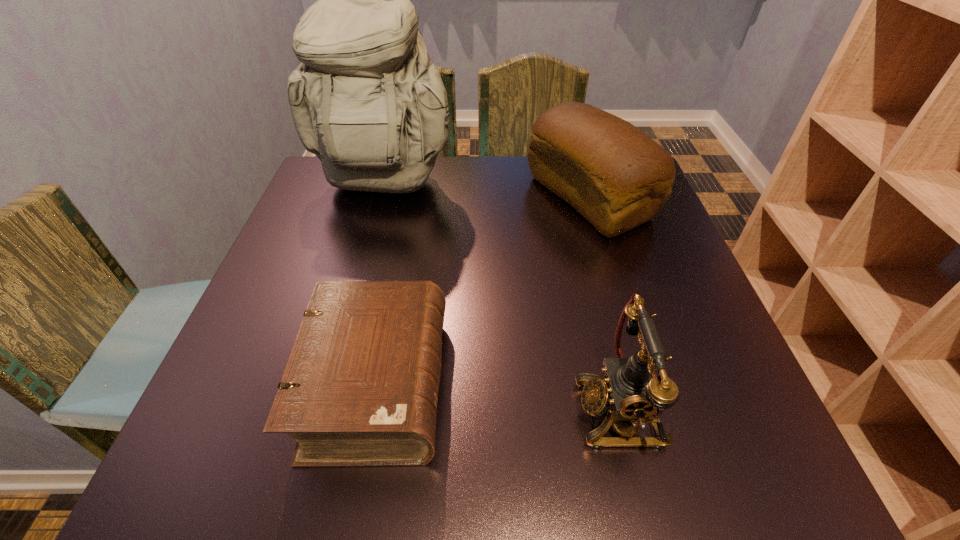
Find the location of a particular element. The width and height of the screenshot is (960, 540). object at the far right corner is located at coordinates (614, 175).

Locate an element on the screen. Image resolution: width=960 pixels, height=540 pixels. object that is at the near right corner is located at coordinates click(x=634, y=392).

Find the location of a particular element. The image size is (960, 540). free space at the far edge of the desktop is located at coordinates (446, 176).

Where is `vacant space at the left edge`? Image resolution: width=960 pixels, height=540 pixels. vacant space at the left edge is located at coordinates (299, 319).

Locate an element on the screen. The height and width of the screenshot is (540, 960). vacant area at the right edge is located at coordinates (611, 256).

The image size is (960, 540). Identify the location of vacant space at the far left corner. (330, 191).

Identify the location of vacant space in between the bread and the Bible. (483, 292).

This screenshot has height=540, width=960. Find the location of `free space that is in between the bread and the tallest object`. free space that is in between the bread and the tallest object is located at coordinates (486, 192).

At what (x,y) coordinates should I click in order to perform the action: click on unoccupied area between the tallest object and the bread. Please return your answer as a coordinate pair (x, y). Image resolution: width=960 pixels, height=540 pixels. Looking at the image, I should click on (486, 192).

I want to click on free point between the shortest object and the telephone, so click(498, 398).